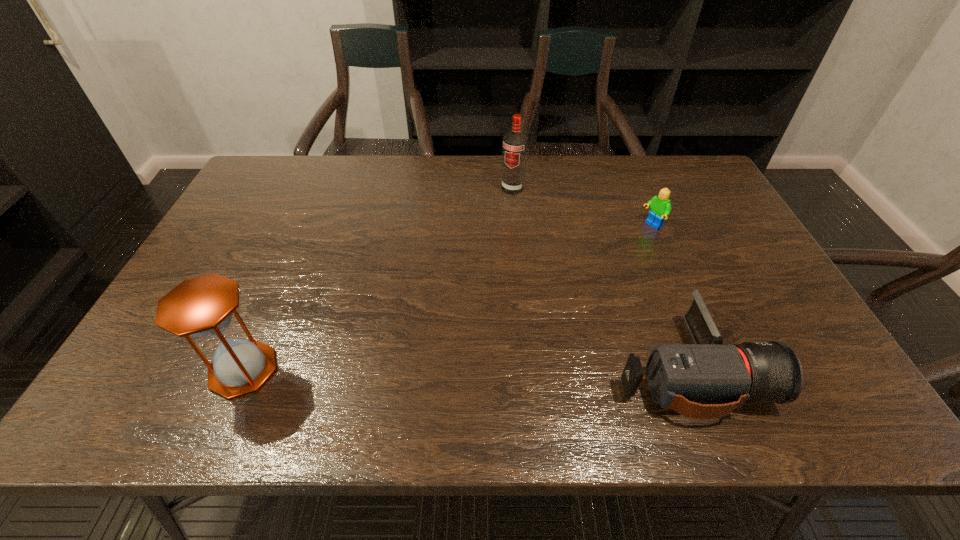
Where is `free spot at the left edge of the desktop`? free spot at the left edge of the desktop is located at coordinates coord(242,221).

In the image, there is a desktop. Where is `free space at the right edge`? Image resolution: width=960 pixels, height=540 pixels. free space at the right edge is located at coordinates (748, 273).

Locate an element on the screen. This screenshot has height=540, width=960. vacant space at the far left corner of the desktop is located at coordinates (296, 166).

In order to click on vacant space that is in between the Lego and the hourglass in this screenshot , I will do `click(447, 298)`.

I want to click on free spot between the hourglass and the Lego, so click(x=447, y=298).

The image size is (960, 540). I want to click on free space between the leftmost object and the camcorder, so click(x=465, y=369).

At what (x,y) coordinates should I click in order to perform the action: click on vacant region between the second farthest object and the vodka. Please return your answer as a coordinate pair (x, y). This screenshot has width=960, height=540. Looking at the image, I should click on (582, 207).

Find the location of a particular element. free space between the leftmost object and the camcorder is located at coordinates (465, 369).

Find the location of `vacant space in between the second object from left to right and the leftmost object`. vacant space in between the second object from left to right and the leftmost object is located at coordinates (378, 279).

This screenshot has width=960, height=540. I want to click on free space between the camcorder and the Lego, so click(x=669, y=297).